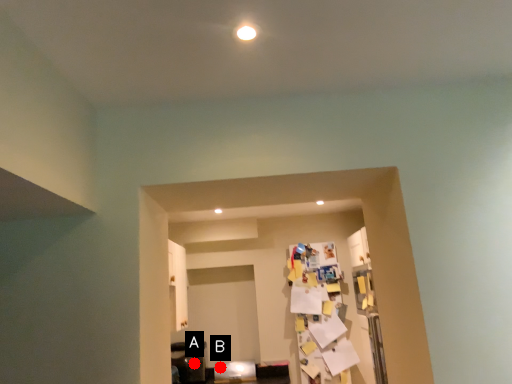
Question: Two points are circled on the image, labeled by A and B beside each circle. Among these points, which one is farthest from the camera?

Choices:
 (A) A is further
 (B) B is further

Answer: (B)